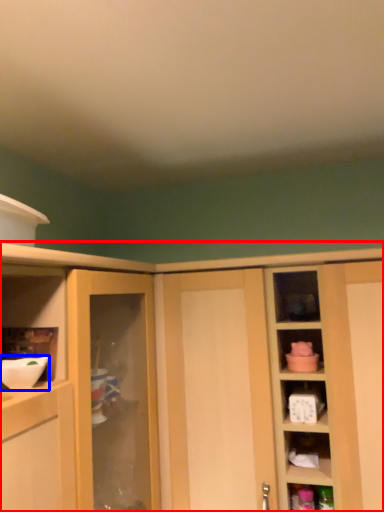
Question: Which point is closer to the camera, cabinetry (highlighted by a red box) or mixing bowl (highlighted by a blue box)?

Choices:
 (A) cabinetry
 (B) mixing bowl

Answer: (B)